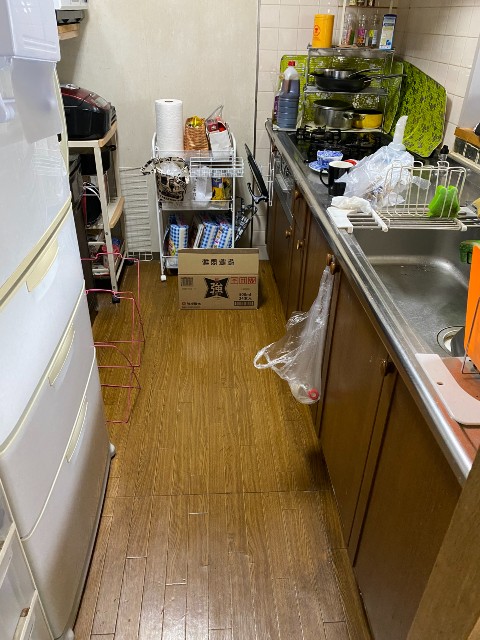
At what (x,y) coordinates should I click in order to perform the action: click on cooking bottles/containers. Please return your answer as a coordinate pair (x, y). Image resolution: width=480 pixels, height=640 pixels. Looking at the image, I should click on tap(322, 29), tap(346, 31), tap(357, 34), tap(370, 34), tap(388, 32), tap(284, 109).